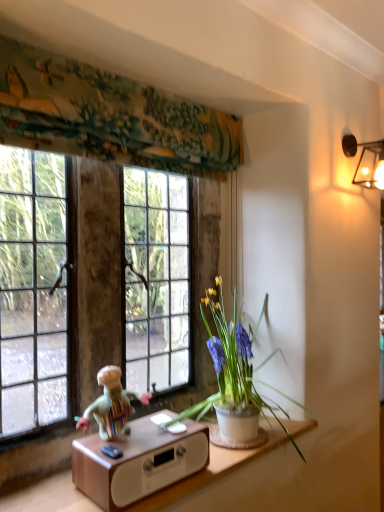
Question: In terms of height, does white ceramic pot at center look taller or shorter compared to textured fabric at upper center?

Choices:
 (A) short
 (B) tall

Answer: (B)

Question: From the image's perspective, is white ceramic pot at center positioned above or below textured fabric at upper center?

Choices:
 (A) below
 (B) above

Answer: (A)

Question: Which object is the farthest from the metallic wall sconce at upper right?

Choices:
 (A) textured fabric at upper center
 (B) wooden table at lower center
 (C) white ceramic pot at center
 (D) clear glass window at upper left
 (E) multicolored fabric doll at lower center

Answer: (B)

Question: Which object is the closest to the metallic wall sconce at upper right?

Choices:
 (A) multicolored fabric doll at lower center
 (B) white ceramic pot at center
 (C) textured fabric at upper center
 (D) wooden table at lower center
 (E) clear glass window at upper left

Answer: (C)